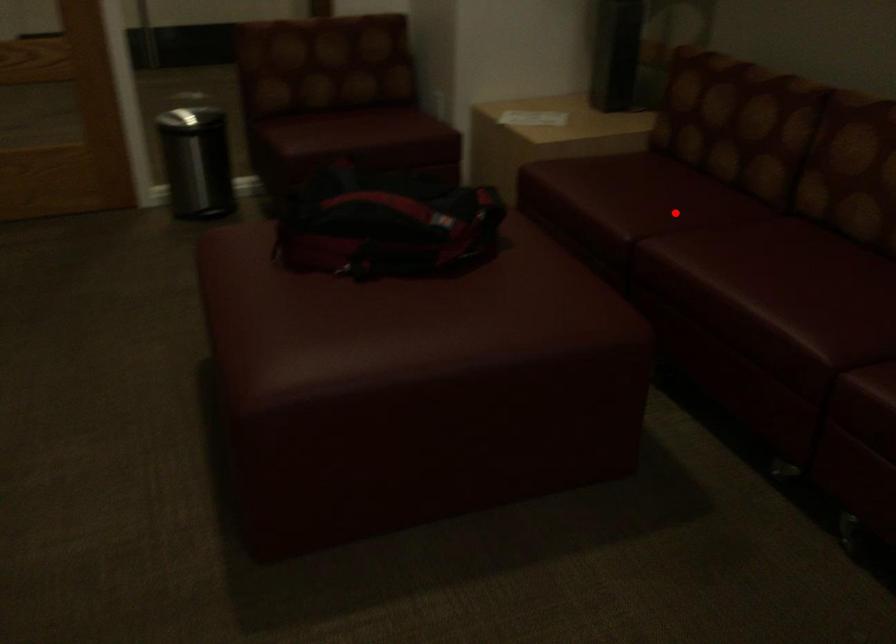
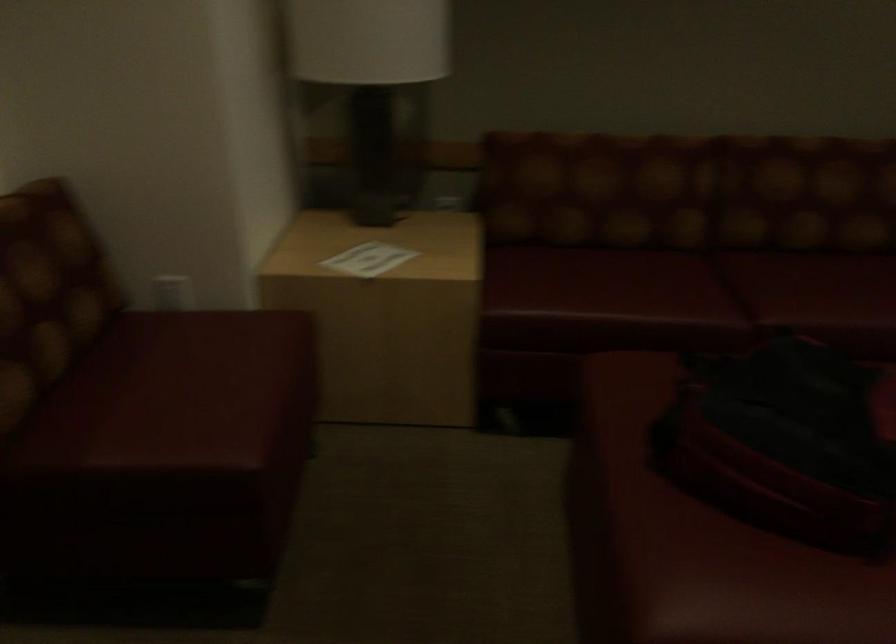
Where in the second image is the point corresponding to the highlighted location from the first image?

(698, 286)